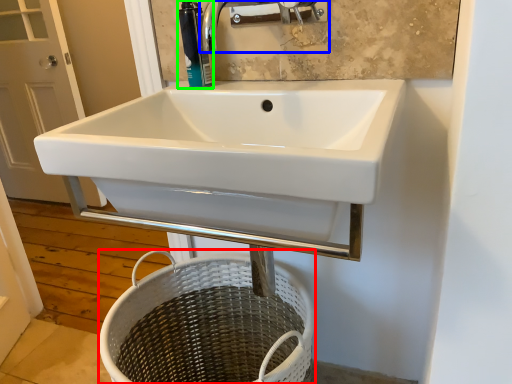
Question: Which object is positioned closest to basket (highlighted by a red box)? Select from tap (highlighted by a blue box) and soap dispenser (highlighted by a green box).

Choices:
 (A) tap
 (B) soap dispenser

Answer: (B)